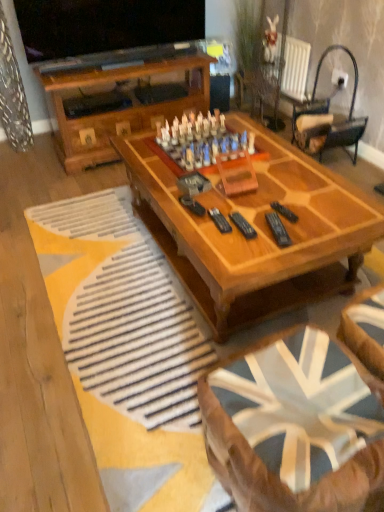
This screenshot has height=512, width=384. Find the location of `free space between black plastic remote at center, which is the 2th remote in left-to-right order, and wooden chess set at center`. free space between black plastic remote at center, which is the 2th remote in left-to-right order, and wooden chess set at center is located at coordinates (246, 192).